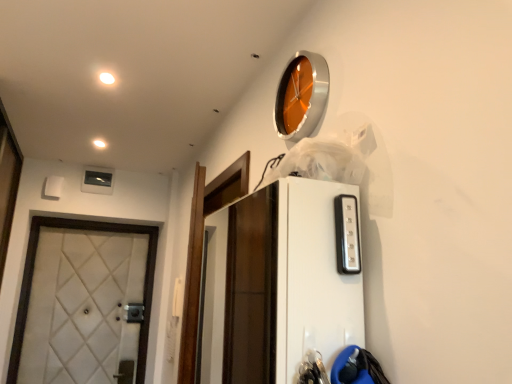
Question: From a real-world perspective, is white quilted fabric door at left positioned over matte white light at upper left, which is counted as the second light, starting from the right, based on gravity?

Choices:
 (A) no
 (B) yes

Answer: (A)

Question: From the image's perspective, would you say white quilted fabric door at left is positioned over matte white light at upper left, marked as the first light in a back-to-front arrangement?

Choices:
 (A) yes
 (B) no

Answer: (B)

Question: Does white quilted fabric door at left have a lesser height compared to matte white light at upper left, marked as the first light in a back-to-front arrangement?

Choices:
 (A) yes
 (B) no

Answer: (B)

Question: Is white quilted fabric door at left facing away from matte white light at upper left, which appears as the first light when viewed from the left?

Choices:
 (A) no
 (B) yes

Answer: (A)

Question: Could you tell me if white quilted fabric door at left is turned towards matte white light at upper left, which appears as the first light when viewed from the left?

Choices:
 (A) no
 (B) yes

Answer: (A)

Question: Is white quilted fabric door at left wider than matte white light at upper left, the 2th light from the front?

Choices:
 (A) yes
 (B) no

Answer: (A)

Question: Can you confirm if orange metallic clock at upper center is wider than white quilted fabric door at left?

Choices:
 (A) yes
 (B) no

Answer: (B)

Question: Is orange metallic clock at upper center positioned behind white quilted fabric door at left?

Choices:
 (A) no
 (B) yes

Answer: (A)

Question: Is orange metallic clock at upper center thinner than white quilted fabric door at left?

Choices:
 (A) no
 (B) yes

Answer: (B)

Question: Is orange metallic clock at upper center far from white quilted fabric door at left?

Choices:
 (A) yes
 (B) no

Answer: (A)

Question: From the image's perspective, is orange metallic clock at upper center over white quilted fabric door at left?

Choices:
 (A) yes
 (B) no

Answer: (A)

Question: From the image's perspective, is orange metallic clock at upper center below white quilted fabric door at left?

Choices:
 (A) yes
 (B) no

Answer: (B)

Question: Considering the relative sizes of orange metallic clock at upper center and white glossy light at upper left, placed as the 2th light when sorted from back to front, in the image provided, is orange metallic clock at upper center smaller than white glossy light at upper left, placed as the 2th light when sorted from back to front,?

Choices:
 (A) no
 (B) yes

Answer: (A)